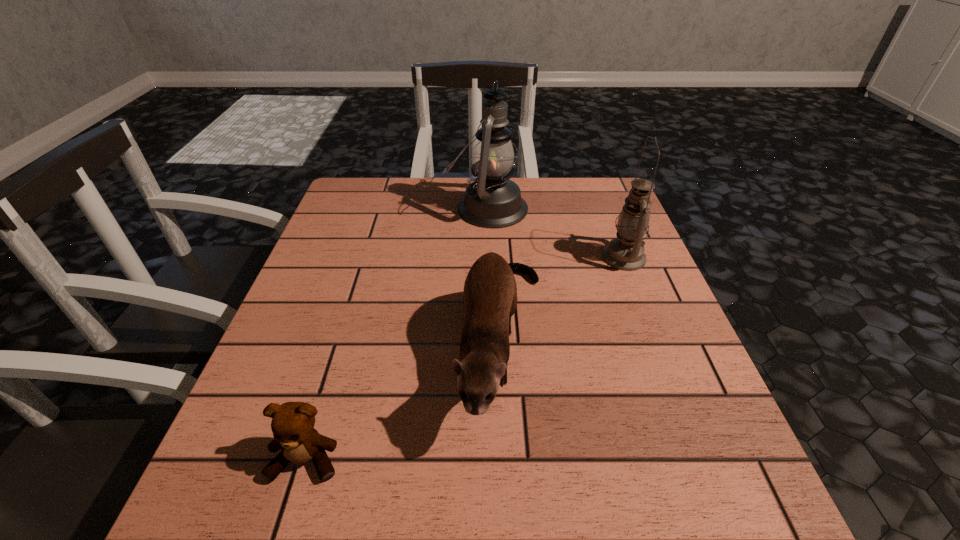
Locate an element on the screen. the closest object relative to the right oil lamp is located at coordinates (490, 293).

Identify the location of free space that satisfies the following two spatial constraints: 1. on the front side of the right oil lamp; 2. on the left side of the farther oil lamp. Image resolution: width=960 pixels, height=540 pixels. (488, 258).